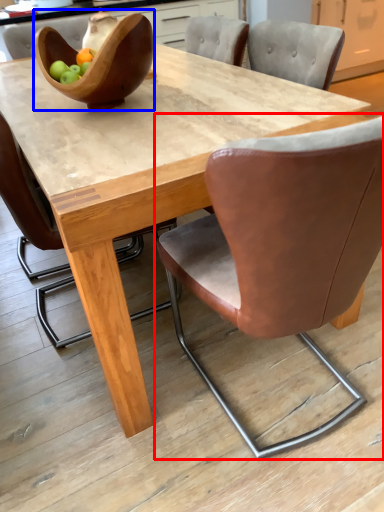
Question: Among these objects, which one is farthest to the camera, chair (highlighted by a red box) or bowl (highlighted by a blue box)?

Choices:
 (A) chair
 (B) bowl

Answer: (B)